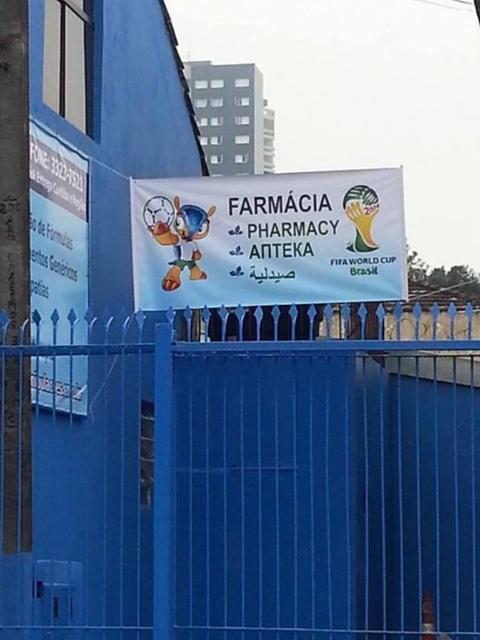
Who is more distant from viewer, (356,324) or (228,266)?

The point (356,324) is behind.

Is blue metal fence at center taller than white fabric banner at center?

Indeed, blue metal fence at center has a greater height compared to white fabric banner at center.

Is point (183, 324) closer to camera compared to point (207, 266)?

No, it is behind (207, 266).

Locate an element on the screen. The height and width of the screenshot is (640, 480). blue metal fence at center is located at coordinates (241, 476).